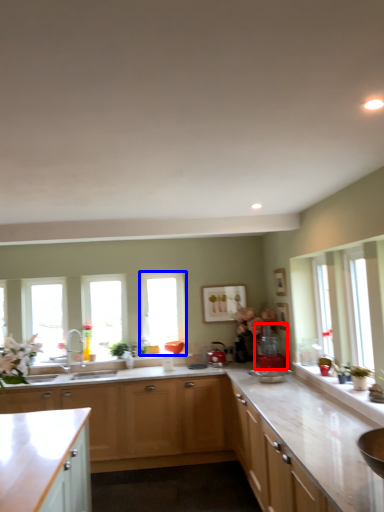
Question: Which object is closer to the camera taking this photo, appliance (highlighted by a red box) or window (highlighted by a blue box)?

Choices:
 (A) appliance
 (B) window

Answer: (A)